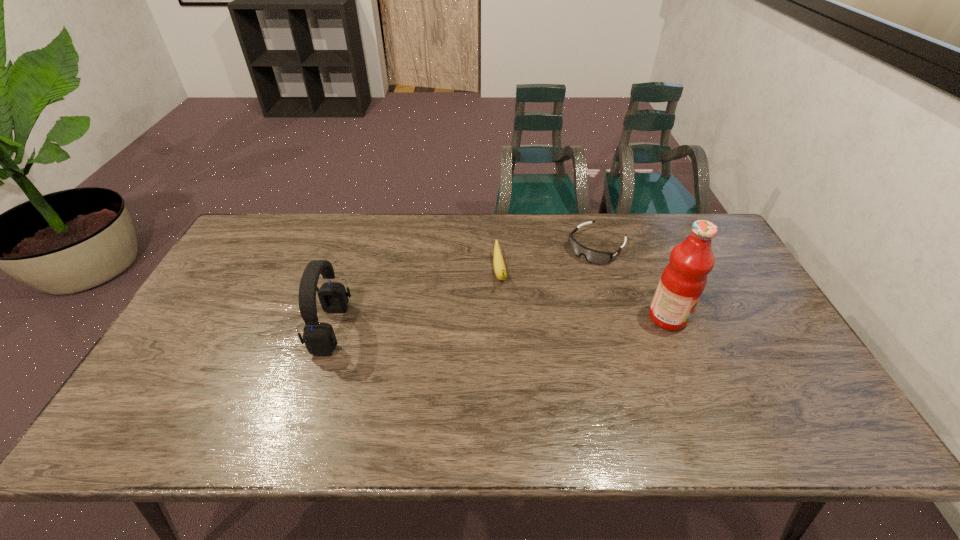
This screenshot has height=540, width=960. In the image, there is a desktop. Identify the location of free space at the left edge. (217, 327).

In the image, there is a desktop. In order to click on vacant space at the right edge in this screenshot , I will do `click(781, 372)`.

In order to click on vacant space at the far left corner of the desktop in this screenshot , I will do `click(264, 235)`.

The image size is (960, 540). In order to click on blank area at the far right corner in this screenshot , I will do (706, 215).

At what (x,y) coordinates should I click in order to perform the action: click on blank region between the second shortest object and the goggles. Please return your answer as a coordinate pair (x, y). The image size is (960, 540). Looking at the image, I should click on (548, 260).

Locate an element on the screen. The image size is (960, 540). unoccupied area between the goggles and the second tallest object is located at coordinates (464, 288).

You are a GUI agent. You are given a task and a screenshot of the screen. Output one action in this format:
    pyautogui.click(x=<x>, y=<y>)
    Task: Click on the free space that is in between the fruit juice and the goggles
    
    Given the screenshot: What is the action you would take?
    [632, 282]

Find the location of `vacant space in between the second tallest object and the goggles`. vacant space in between the second tallest object and the goggles is located at coordinates (464, 288).

Identify the location of vacant area between the goggles and the tallest object. (632, 282).

Identify the location of vacant space that is in between the fruit juice and the goggles. (632, 282).